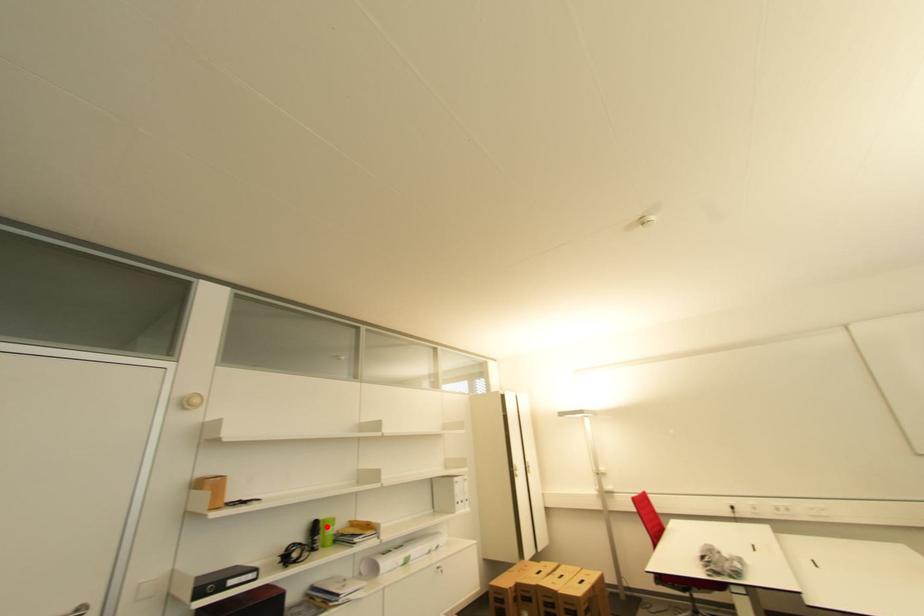
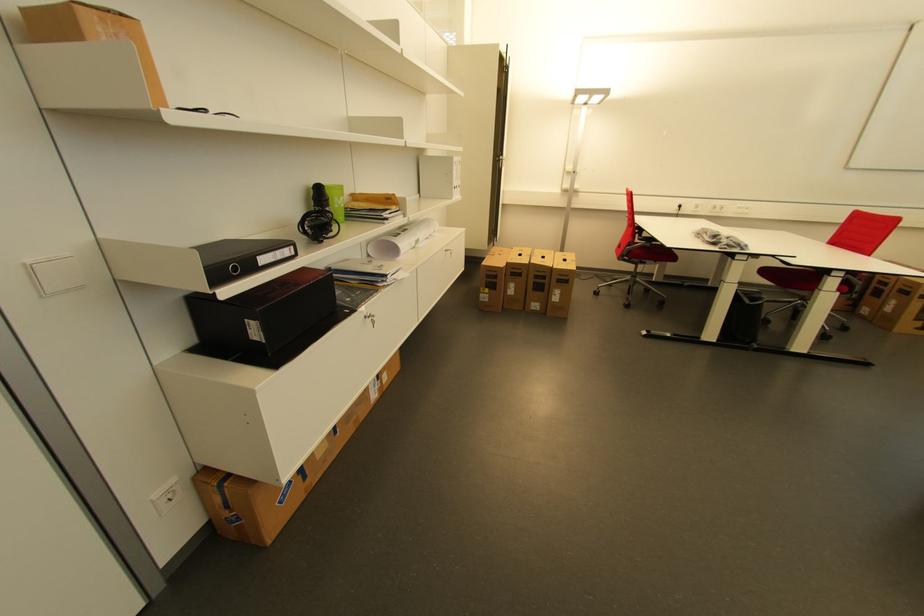
Where in the second image is the point corresponding to the highlighted location from the first image?

(333, 193)